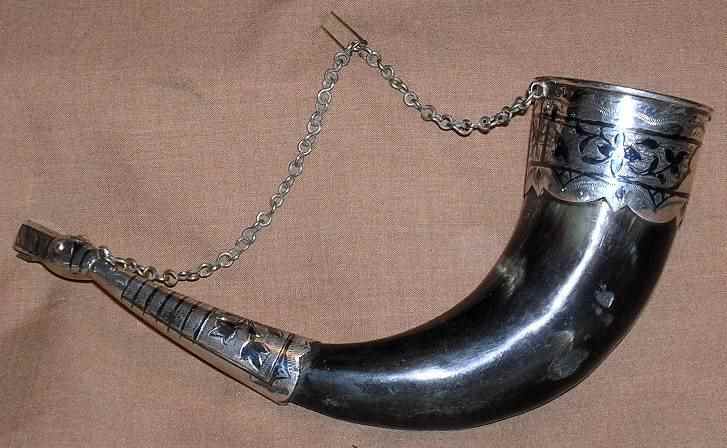
Find the location of a particular element. The width and height of the screenshot is (727, 448). fabric background is located at coordinates (349, 221).